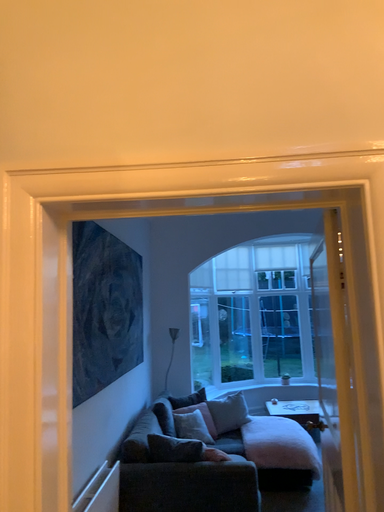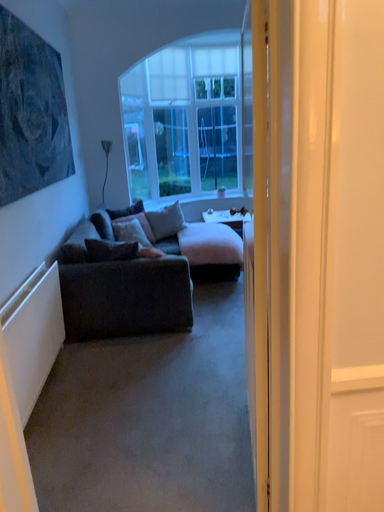
Question: Which way did the camera rotate in the video?

Choices:
 (A) rotated right
 (B) rotated left

Answer: (A)